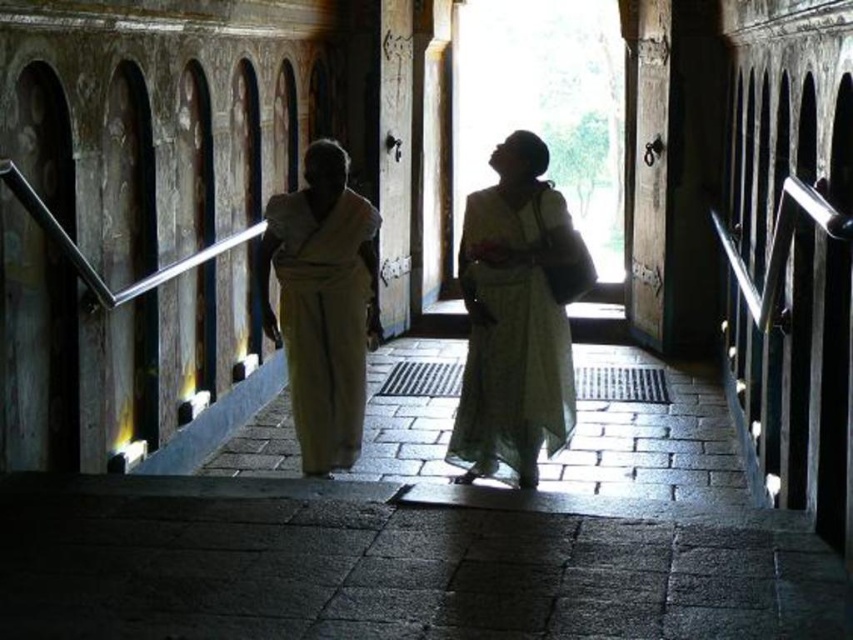
Question: Which of the following is the farthest from the observer?

Choices:
 (A) (352, 298)
 (B) (476, 410)

Answer: (A)

Question: Is white sheer dress at center below light beige fabric monk at center?

Choices:
 (A) yes
 (B) no

Answer: (A)

Question: Does white sheer dress at center have a smaller size compared to light beige fabric monk at center?

Choices:
 (A) no
 (B) yes

Answer: (B)

Question: Is white sheer dress at center above light beige fabric monk at center?

Choices:
 (A) no
 (B) yes

Answer: (A)

Question: Which object is closer to the camera taking this photo?

Choices:
 (A) light beige fabric monk at center
 (B) white sheer dress at center

Answer: (B)